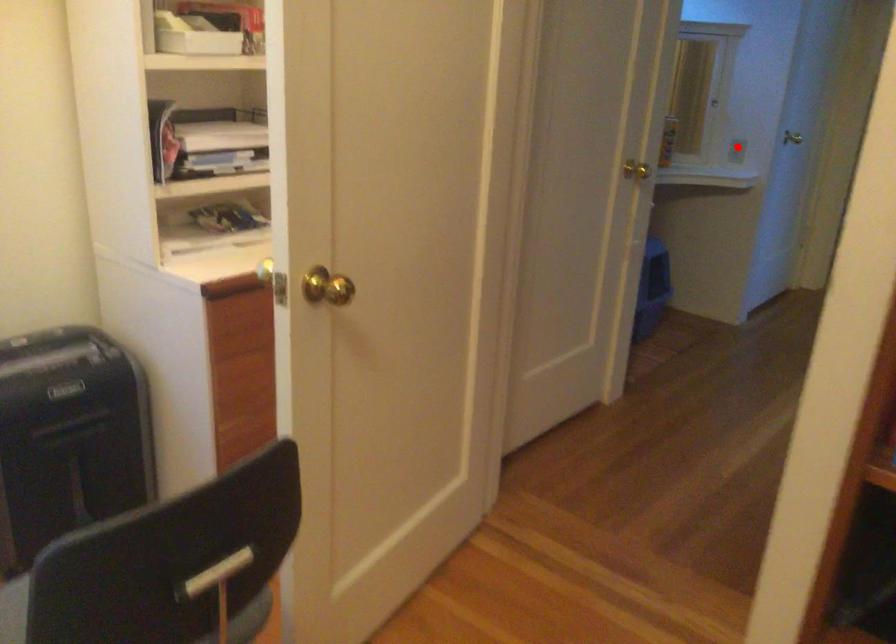
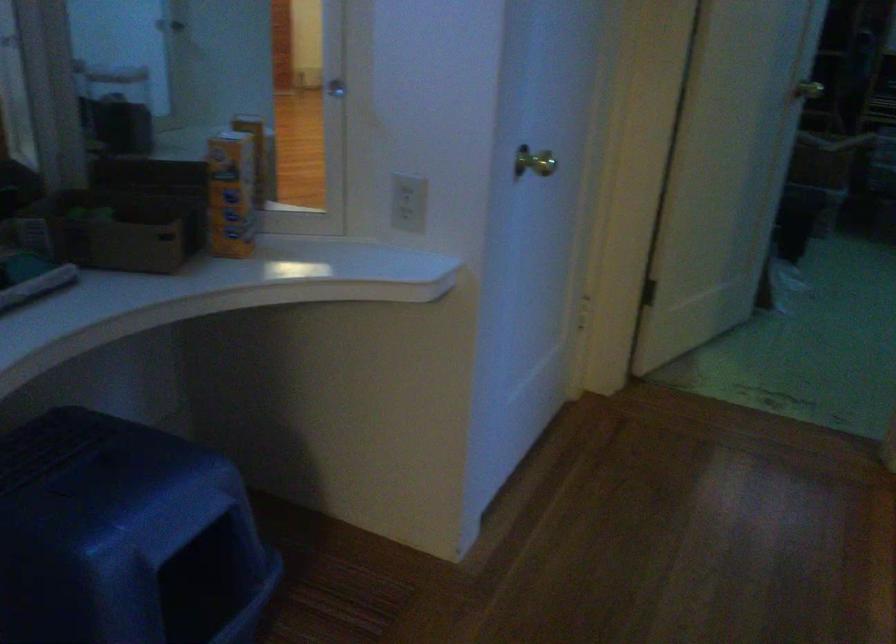
Question: A red point is marked in image1. In image2, is the corresponding 3D point closer to the camera or farther? Reply with the corresponding letter.

Choices:
 (A) The corresponding 3D point is closer.
 (B) The corresponding 3D point is farther.

Answer: (A)